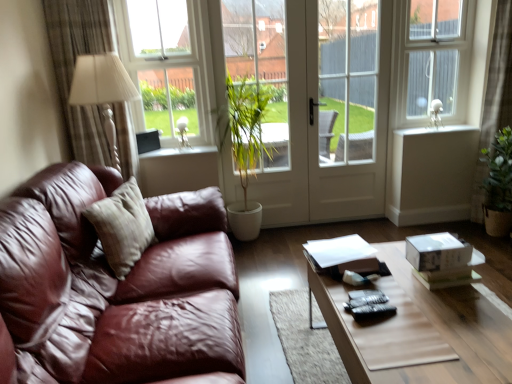
Question: Is green leafy plant at center in front of beige fabric curtain at left, which appears as the first curtain when viewed from the left?

Choices:
 (A) yes
 (B) no

Answer: (B)

Question: Can you confirm if green leafy plant at center is positioned to the left of beige fabric curtain at left, which appears as the first curtain when viewed from the left?

Choices:
 (A) yes
 (B) no

Answer: (B)

Question: From a real-world perspective, is green leafy plant at center located higher than beige fabric curtain at left, which appears as the first curtain when viewed from the left?

Choices:
 (A) yes
 (B) no

Answer: (B)

Question: Can you confirm if green leafy plant at center is shorter than beige fabric curtain at left, which is the 2th curtain from right to left?

Choices:
 (A) no
 (B) yes

Answer: (A)

Question: Is green leafy plant at center further to camera compared to beige fabric curtain at left, which appears as the first curtain when viewed from the left?

Choices:
 (A) no
 (B) yes

Answer: (B)

Question: Could you tell me if green leafy plant at center is facing beige fabric curtain at left, which is the 2th curtain from right to left?

Choices:
 (A) yes
 (B) no

Answer: (B)

Question: Can you confirm if green leafy plant at center is wider than white glossy window sill at upper center, marked as the first window sill in a left-to-right arrangement?

Choices:
 (A) no
 (B) yes

Answer: (A)

Question: Can you confirm if green leafy plant at center is shorter than white glossy window sill at upper center, marked as the first window sill in a left-to-right arrangement?

Choices:
 (A) no
 (B) yes

Answer: (A)

Question: From a real-world perspective, does green leafy plant at center sit lower than white glossy window sill at upper center, which appears as the second window sill when viewed from the right?

Choices:
 (A) yes
 (B) no

Answer: (B)

Question: From a real-world perspective, is green leafy plant at center located higher than white glossy window sill at upper center, the 1th window sill positioned from the bottom?

Choices:
 (A) yes
 (B) no

Answer: (A)

Question: Is green leafy plant at center taller than white glossy window sill at upper center, marked as the first window sill in a left-to-right arrangement?

Choices:
 (A) yes
 (B) no

Answer: (A)

Question: From the image's perspective, would you say green leafy plant at center is positioned over white glossy window sill at upper center, acting as the 2th window sill starting from the top?

Choices:
 (A) yes
 (B) no

Answer: (A)

Question: Does silky beige curtain at right, marked as the 1th curtain in a right-to-left arrangement, lie behind white smooth window sill at upper right, the 2th window sill positioned from the bottom?

Choices:
 (A) no
 (B) yes

Answer: (A)